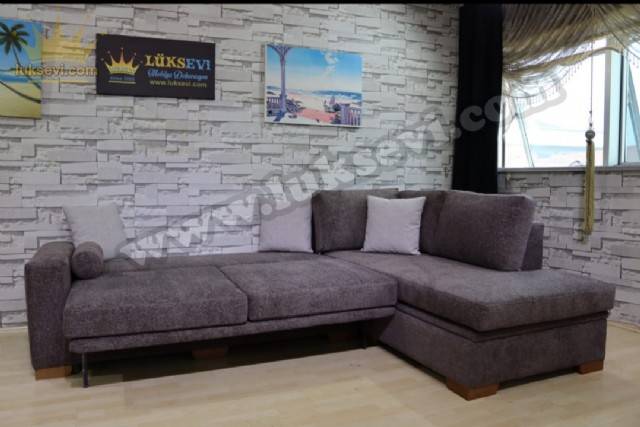
The width and height of the screenshot is (640, 427). I want to click on wall, so click(x=387, y=101).